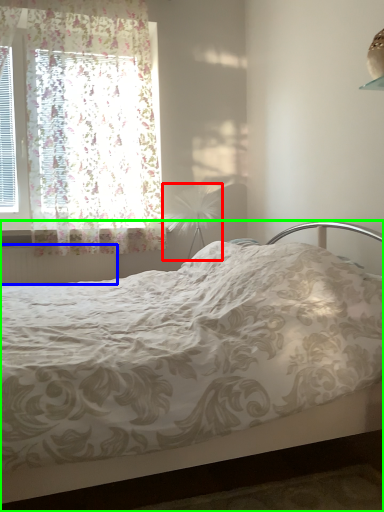
Question: Based on their relative distances, which object is nearer to table lamp (highlighted by a red box)? Choose from radiator (highlighted by a blue box) and bed (highlighted by a green box).

Choices:
 (A) radiator
 (B) bed

Answer: (A)